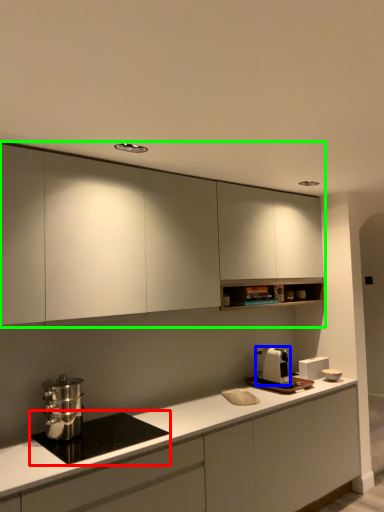
Question: Which object is positioned closest to home appliance (highlighted by a red box)? Select from kitchen appliance (highlighted by a blue box) and cabinetry (highlighted by a green box).

Choices:
 (A) kitchen appliance
 (B) cabinetry

Answer: (B)